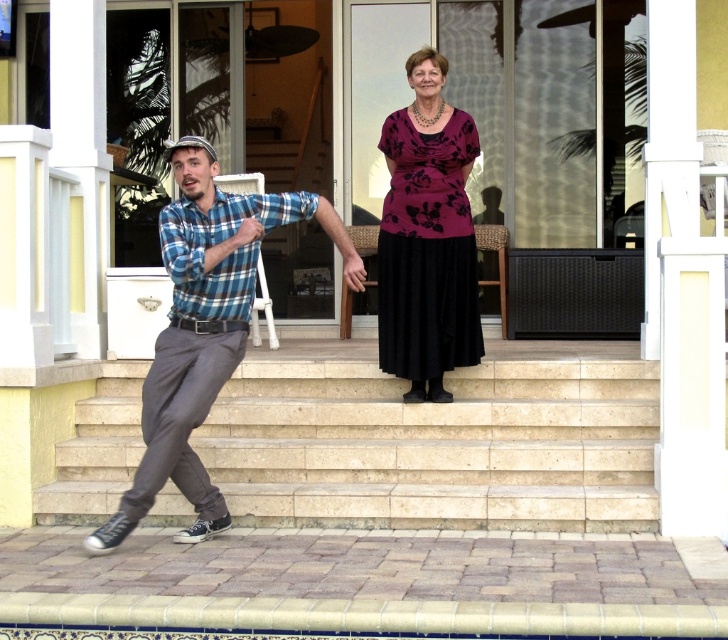
Looking at this image, you are standing at the point labeled point (x=183, y=444) and want to walk to the point labeled point (x=443, y=244). Which direction should you move to get closer to your destination?

You should move towards the direction away from the viewer since point (x=183, y=444) is closer to the viewer than point (x=443, y=244).

Consider the image. You are a painter standing on the beige stone stairs at center and want to paint the blue plaid shirt at lower left. Since the stairs are much taller than the shirt, will you have to look up or down to focus on the shirt?

The beige stone stairs at center is much taller than the blue plaid shirt at lower left, so you will have to look down to focus on the shirt.

Consider the image. You are standing at point [183,241] and want to move to point [290,368]. Is the point you want to reach located behind you or in front of you?

The point [290,368] is behind point [183,241], so the point you want to reach is behind you.